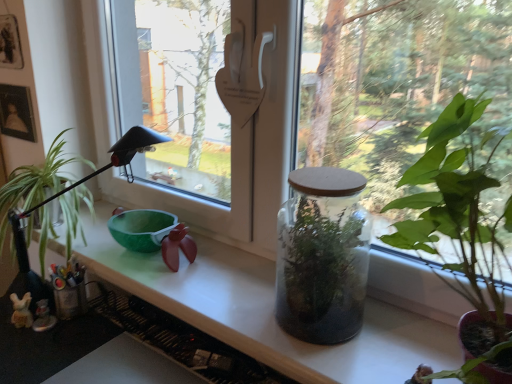
Where is `empty space that is ontop of translucent glass jar at center (from a real-world perspective)`? The width and height of the screenshot is (512, 384). empty space that is ontop of translucent glass jar at center (from a real-world perspective) is located at coordinates (203, 273).